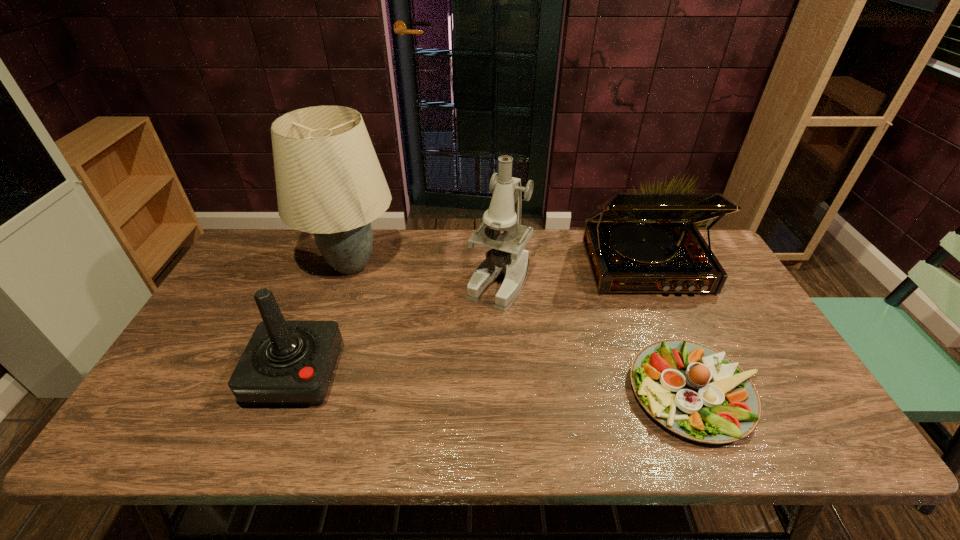
The image size is (960, 540). Find the location of `vacant space at the near edge of the desktop`. vacant space at the near edge of the desktop is located at coordinates (328, 449).

In the image, there is a desktop. Where is `blank space at the left edge`? Image resolution: width=960 pixels, height=540 pixels. blank space at the left edge is located at coordinates (167, 372).

Find the location of a particular element. free location at the far left corner is located at coordinates (268, 250).

The image size is (960, 540). What are the coordinates of `free space at the near left corner of the desktop` in the screenshot? It's located at (139, 416).

You are a GUI agent. You are given a task and a screenshot of the screen. Output one action in this format:
    pyautogui.click(x=<x>, y=<y>)
    Task: Click on the free location at the near right corner of the desktop
    The width and height of the screenshot is (960, 540).
    Given the screenshot: What is the action you would take?
    pyautogui.click(x=760, y=427)

This screenshot has width=960, height=540. In order to click on free space between the joystick and the lampshade in this screenshot , I will do `click(324, 320)`.

At what (x,y) coordinates should I click in order to perform the action: click on empty space between the joystick and the lampshade. Please return your answer as a coordinate pair (x, y). The image size is (960, 540). Looking at the image, I should click on (324, 320).

Locate an element on the screen. The height and width of the screenshot is (540, 960). unoccupied area between the record player and the fourth shortest object is located at coordinates (572, 274).

This screenshot has width=960, height=540. In order to click on empty space that is in between the lampshade and the shortest object in this screenshot , I will do `click(523, 329)`.

Identify the location of free space that is in between the joystick and the record player. (470, 320).